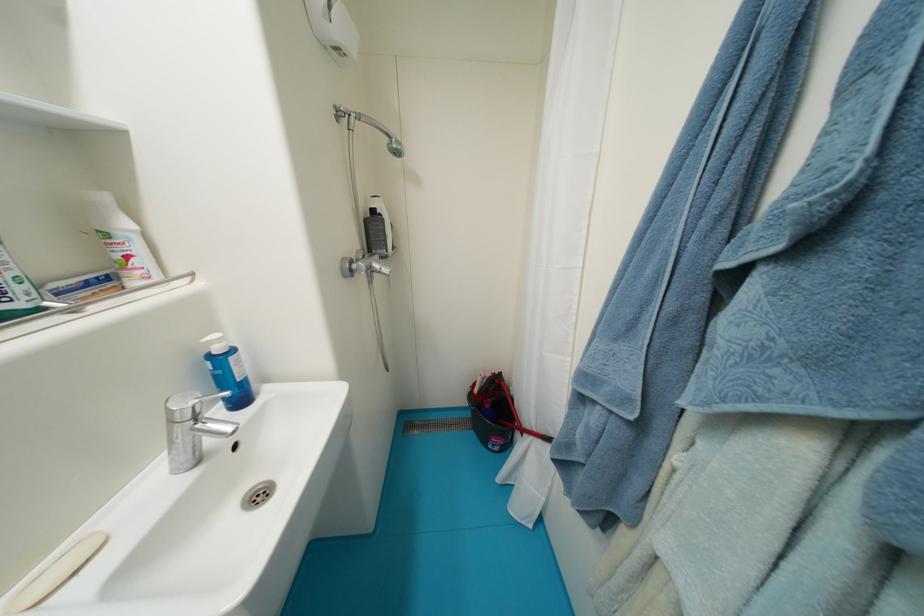
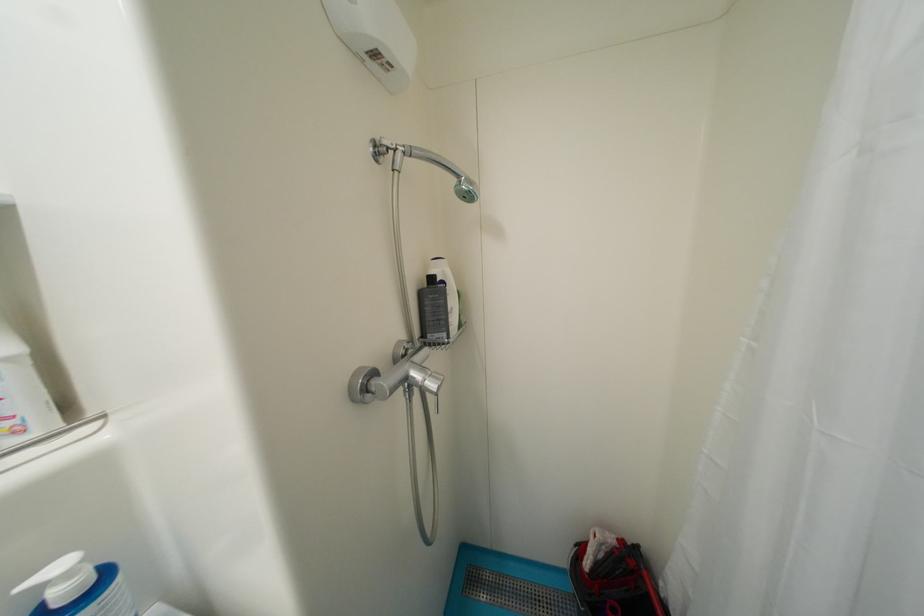
Question: What movement of the cameraman would produce the second image?

Choices:
 (A) Left
 (B) Right
 (C) Forward
 (D) Backward

Answer: (C)